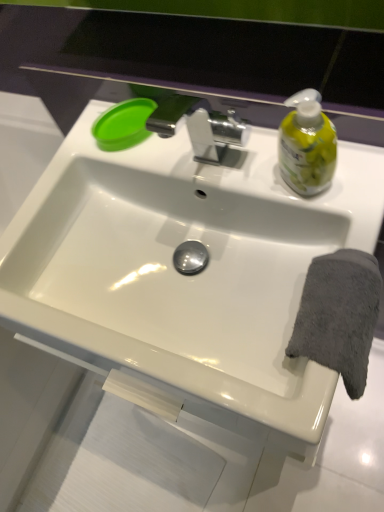
Identify the location of space that is in front of green plastic lid at upper left. tap(174, 158).